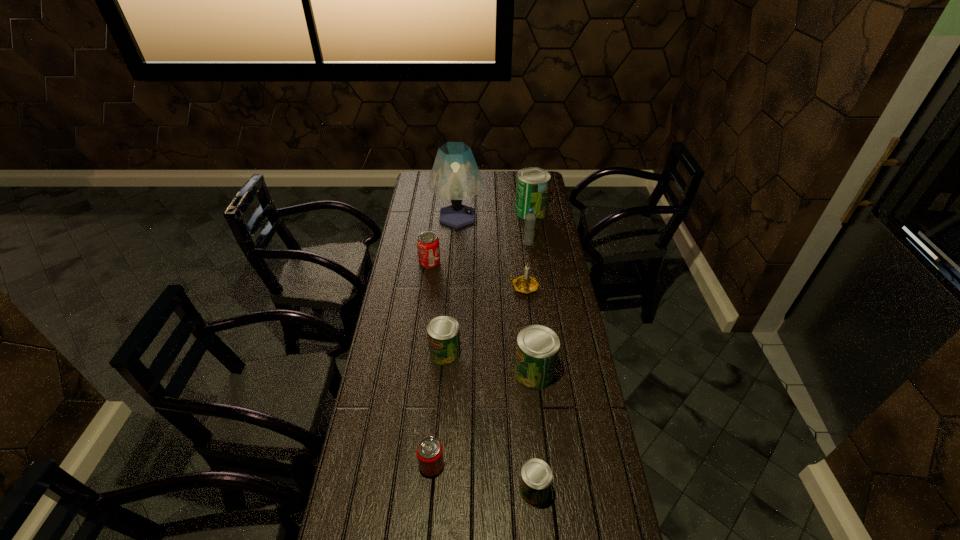
The image size is (960, 540). What are the coordinates of `free space between the light lampshade and the smallest green can` in the screenshot? It's located at (495, 354).

Identify the location of unoccupied position between the leftmost green can and the farther red can. This screenshot has width=960, height=540. (438, 308).

Where is `free point between the second biggest green can and the fifth nearest can`? Image resolution: width=960 pixels, height=540 pixels. free point between the second biggest green can and the fifth nearest can is located at coordinates (482, 318).

This screenshot has height=540, width=960. What are the coordinates of `unoccupied area between the farther red can and the seventh nearest object` in the screenshot? It's located at (479, 253).

Locate an element on the screen. vacant space in between the tallest can and the leftmost green can is located at coordinates (488, 282).

Locate an element on the screen. The height and width of the screenshot is (540, 960). free space that is in between the smallest green can and the farther red can is located at coordinates (482, 376).

At what (x,y) coordinates should I click in order to perform the action: click on free space between the candle holder and the leftmost green can. Please return your answer as a coordinate pair (x, y). Looking at the image, I should click on (485, 320).

Identify the location of vacant area between the fourth farthest object and the smaller red can. (431, 363).

This screenshot has height=540, width=960. In order to click on free space between the fifth shortest can and the water bottle in this screenshot , I will do `click(531, 308)`.

Select which object is the fourth closest to the nearest green can. Please provide its 2D coordinates. Your answer should be formatted as a tuple, i.e. [(x, y)], where the tuple contains the x and y coordinates of a point satisfying the conditions above.

[(525, 284)]